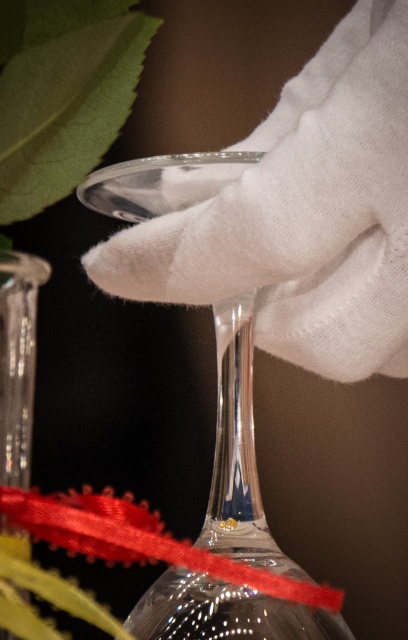
You are an assistant organizing a gift box. You see the white cotton glove at center and the transparent glass vase at center in the box. Which object is positioned higher in the box?

The white cotton glove at center is above the transparent glass vase at center, so it is positioned higher in the box.

You are an assistant arranging items on a table. You have a white cotton glove at center and a transparent glass vase at center. Based on the scene, which object is closer to you?

The white cotton glove at center is closer to you because the transparent glass vase at center is behind it.

You are an assistant organizing a display. You need to place the white cotton glove at center and transparent glass vase at center on a shelf. The shelf has a height limit of 15 cm. Can both items fit vertically without exceeding the height limit?

The white cotton glove at center is taller than the transparent glass vase at center. Since the shelf has a height limit of 15 cm, we need to know the exact heights of both items to determine if they fit. However, the provided information only states their relative height comparison, not their actual measurements. Therefore, it is impossible to confirm if both items will fit within the 15 cm limit based on the given data.